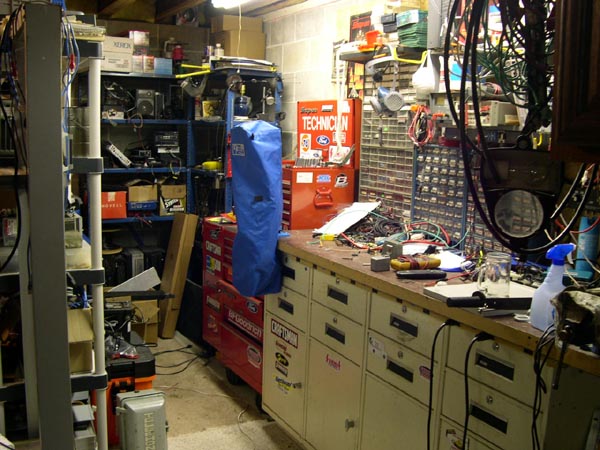
You are a GUI agent. You are given a task and a screenshot of the screen. Output one action in this format:
    pyautogui.click(x=<x>, y=<y>)
    Task: Click on the shelving units
    Image resolution: width=600 pixels, height=450 pixels.
    Given the screenshot: What is the action you would take?
    pyautogui.click(x=92, y=215), pyautogui.click(x=133, y=166), pyautogui.click(x=227, y=161)